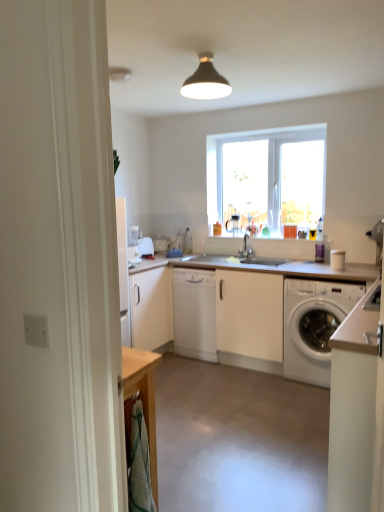
Locate an element on the screen. white matte washing machine at lower right is located at coordinates (314, 326).

Locate an element on the screen. This screenshot has width=384, height=512. transparent glass window at center is located at coordinates (267, 176).

Describe the element at coordinates (267, 176) in the screenshot. I see `transparent glass window at center` at that location.

What do you see at coordinates (146, 247) in the screenshot? This screenshot has width=384, height=512. I see `white glossy microwave at upper left` at bounding box center [146, 247].

Identify the location of white glossy microwave at upper left. The width and height of the screenshot is (384, 512). (146, 247).

You are a GUI agent. You are given a task and a screenshot of the screen. Output one action in this format:
    pyautogui.click(x=<x>, y=<y>)
    Task: Click on the white matte cabinet at center, which ranks as the 1th cabinetry in left-to-right order
    This screenshot has width=384, height=512.
    Given the screenshot: What is the action you would take?
    pyautogui.click(x=194, y=313)

At what (x,y) coordinates should I click in order to perform the action: click on white matte countertop at center. Please return your answer as a coordinate pair (x, y). Looking at the image, I should click on (241, 311).

What are the coordinates of `white matte washing machine at lower right` in the screenshot? It's located at (314, 326).

Is white matte cabinet at center, which is the 2th cabinetry from front to back, not near white matte washing machine at lower right?

white matte cabinet at center, which is the 2th cabinetry from front to back, is near white matte washing machine at lower right, not far away.

Considering the sizes of white matte cabinet at center, which ranks as the 1th cabinetry in left-to-right order, and white matte washing machine at lower right in the image, is white matte cabinet at center, which ranks as the 1th cabinetry in left-to-right order, wider or thinner than white matte washing machine at lower right?

In the image, white matte cabinet at center, which ranks as the 1th cabinetry in left-to-right order, appears to be more narrow than white matte washing machine at lower right.

Consider the image. Between white matte cabinet at center, which is the 2th cabinetry from front to back, and white matte washing machine at lower right, which one has larger size?

Bigger between the two is white matte washing machine at lower right.

Which is more distant, (x=210, y=95) or (x=239, y=307)?

The point (x=239, y=307) is behind.

From the image's perspective, relative to white matte countertop at center, is matte black lampshade at upper center above or below?

matte black lampshade at upper center is situated higher than white matte countertop at center in the image.

Can you tell me how much matte black lampshade at upper center and white matte countertop at center differ in facing direction?

They differ by 0.443 degrees in their facing directions.

Considering the sizes of objects matte black lampshade at upper center and white matte countertop at center in the image provided, who is thinner, matte black lampshade at upper center or white matte countertop at center?

matte black lampshade at upper center.

From a real-world perspective, is transparent glass window at center located higher than white matte cabinet at center, which ranks as the 1th cabinetry in left-to-right order?

Correct, in the physical world, transparent glass window at center is higher than white matte cabinet at center, which ranks as the 1th cabinetry in left-to-right order.

Which of these two, transparent glass window at center or white matte cabinet at center, which is counted as the second cabinetry, starting from the right, stands shorter?

With less height is white matte cabinet at center, which is counted as the second cabinetry, starting from the right.

Can we say transparent glass window at center lies outside white matte cabinet at center, which ranks as the 1th cabinetry in left-to-right order?

Indeed, transparent glass window at center is completely outside white matte cabinet at center, which ranks as the 1th cabinetry in left-to-right order.

From the picture: Is transparent glass window at center aimed at white matte cabinet at center, the first cabinetry from the back?

No, transparent glass window at center does not turn towards white matte cabinet at center, the first cabinetry from the back.

Is transparent glass window at center oriented towards white glossy microwave at upper left?

No, transparent glass window at center is not oriented towards white glossy microwave at upper left.

From a real-world perspective, is transparent glass window at center located beneath white glossy microwave at upper left?

Incorrect, from a real-world perspective, transparent glass window at center is higher than white glossy microwave at upper left.

From the image's perspective, is transparent glass window at center located above or below white glossy microwave at upper left?

Based on their image positions, transparent glass window at center is located above white glossy microwave at upper left.

From the picture: Can you confirm if white matte countertop at center is positioned to the right of white glossy microwave at upper left?

Yes, white matte countertop at center is to the right of white glossy microwave at upper left.

From the image's perspective, is white matte countertop at center located above white glossy microwave at upper left?

Actually, white matte countertop at center appears below white glossy microwave at upper left in the image.

In the scene shown: Is the surface of transparent glass window at center in direct contact with white matte countertop at center?

transparent glass window at center and white matte countertop at center are not in contact.

Considering the points (270, 151) and (246, 319), which point is behind, point (270, 151) or point (246, 319)?

Point (270, 151)

From a real-world perspective, between transparent glass window at center and white matte countertop at center, who is vertically higher?

transparent glass window at center.

Is transparent glass window at center oriented away from white matte countertop at center?

No, white matte countertop at center is not at the back of transparent glass window at center.

Based on the photo, is white matte washing machine at lower right with white matte countertop at center?

No, white matte washing machine at lower right is not with white matte countertop at center.

Looking at this image, can you confirm if white matte washing machine at lower right is smaller than white matte countertop at center?

Yes, white matte washing machine at lower right is smaller than white matte countertop at center.

From the image's perspective, which one is positioned higher, white matte washing machine at lower right or white matte countertop at center?

white matte countertop at center appears higher in the image.

At what (x,y) coordinates should I click in order to perform the action: click on washing machine beneath the white matte cabinet at center, the first cabinetry from the back (from a real-world perspective). Please return your answer as a coordinate pair (x, y). The image size is (384, 512). Looking at the image, I should click on (314, 326).

I want to click on light fixture that is on the left side of white matte countertop at center, so click(x=206, y=81).

From the image, which object appears to be nearer to white matte countertop at center, white matte cabinet at lower right, arranged as the 1th cabinetry when viewed from the right, or silver metallic faucet at center?

silver metallic faucet at center lies closer to white matte countertop at center than the other object.

Looking at the image, which one is located closer to transparent glass window at center, white matte cabinet at lower right, which is counted as the second cabinetry, starting from the back, or white matte washing machine at lower right?

white matte washing machine at lower right is closer to transparent glass window at center.

Considering their positions, is matte black lampshade at upper center positioned closer to transparent glass window at center than white matte cabinet at lower right, which is counted as the second cabinetry, starting from the back?

matte black lampshade at upper center.

When comparing their distances from white matte washing machine at lower right, does matte black lampshade at upper center or transparent glass window at center seem further?

The object further to white matte washing machine at lower right is matte black lampshade at upper center.

From the image, which object appears to be farther from white matte washing machine at lower right, transparent glass window at center or white matte cabinet at lower right, the second cabinetry in the left-to-right sequence?

white matte cabinet at lower right, the second cabinetry in the left-to-right sequence, lies further to white matte washing machine at lower right than the other object.

Estimate the real-world distances between objects in this image. Which object is closer to white glossy microwave at upper left, transparent glass window at center or white matte cabinet at lower right, which is counted as the second cabinetry, starting from the back?

The object closer to white glossy microwave at upper left is transparent glass window at center.

Estimate the real-world distances between objects in this image. Which object is further from silver metallic faucet at center, white matte cabinet at center, which ranks as the 1th cabinetry in left-to-right order, or transparent glass window at center?

white matte cabinet at center, which ranks as the 1th cabinetry in left-to-right order, lies further to silver metallic faucet at center than the other object.

Estimate the real-world distances between objects in this image. Which object is further from white matte washing machine at lower right, white matte cabinet at lower right, which is counted as the second cabinetry, starting from the back, or white matte cabinet at center, which is the 2th cabinetry from front to back?

white matte cabinet at lower right, which is counted as the second cabinetry, starting from the back, is further to white matte washing machine at lower right.

What are the coordinates of `cabinetry between white matte countertop at center and silver metallic faucet at center from front to back` in the screenshot? It's located at (194, 313).

The width and height of the screenshot is (384, 512). In order to click on window between white matte cabinet at lower right, which appears as the first cabinetry when viewed from the front, and white glossy microwave at upper left from front to back in this screenshot , I will do `click(267, 176)`.

Locate an element on the screen. light fixture positioned between white matte cabinet at lower right, which appears as the first cabinetry when viewed from the front, and white matte cabinet at center, the first cabinetry from the back, from near to far is located at coordinates (206, 81).

The height and width of the screenshot is (512, 384). I want to click on countertop that lies between matte black lampshade at upper center and white matte cabinet at center, which ranks as the 1th cabinetry in left-to-right order, from top to bottom, so click(x=241, y=311).